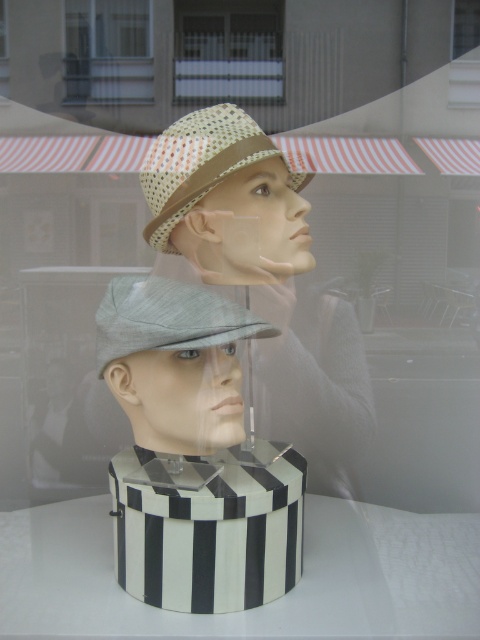
In the scene shown: You are standing outside the shop window and want to see the display inside. Which object, the white mesh fence at upper center or the clear glass window at upper center, would allow you to see through to the display better?

The clear glass window at upper center allows better visibility through it compared to the white mesh fence at upper center, so you can see the display better through the clear glass window at upper center.

You are a customer in the shop and want to buy the hat located at point (x=193, y=452). Can you tell me which hat is at that location?

The black and white striped hat at center is located at point (x=193, y=452).

You are a customer looking at the display through the shop window. You notice the black and white striped hat at center and the white mesh fence at upper center. Which object is positioned closer to you?

The black and white striped hat at center is closer to the viewer than the white mesh fence at upper center.